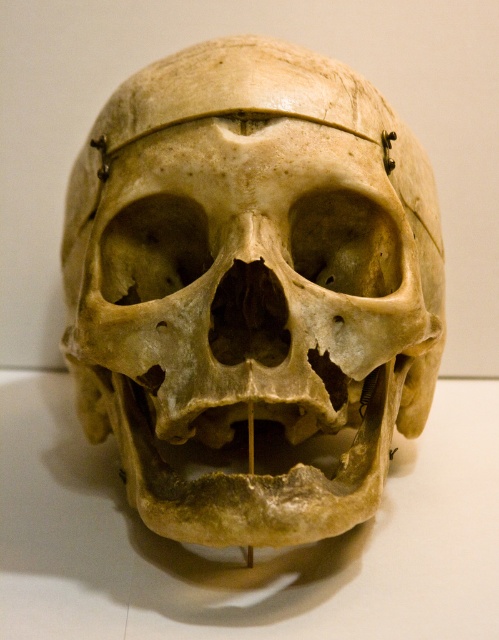
You are a museum visitor standing in front of the skull exhibit. There are two points marked on the skull, point (x=158, y=76) and point (x=62, y=387). Which of these points is nearer to you?

Point (x=158, y=76) is closer to the viewer than point (x=62, y=387).

You are a museum visitor standing in front of the skull exhibit. You notice a small metal pin at point [251,284]. What is located at that point?

The point [251,284] indicates the bone of the skull at center, so the small metal pin is attached to the skull.